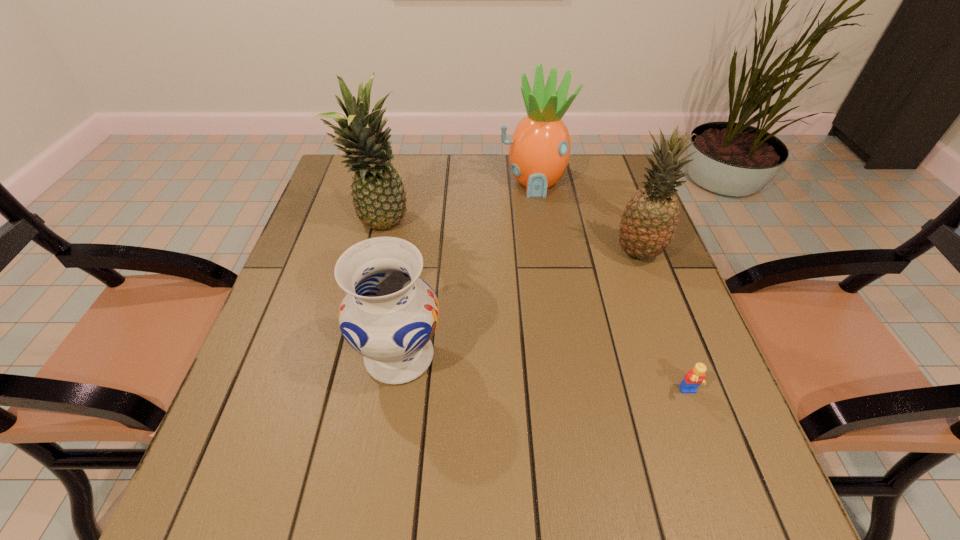
Find the location of a particular element. Image resolution: width=960 pixels, height=540 pixels. unoccupied area between the rightmost pineapple and the second shortest object is located at coordinates (518, 304).

The image size is (960, 540). What are the coordinates of `empty space between the farthest pineapple and the shortest object` in the screenshot? It's located at (612, 287).

Locate an element on the screen. The image size is (960, 540). object that is the third closest to the farthest object is located at coordinates (389, 314).

Locate an element on the screen. The width and height of the screenshot is (960, 540). the third closest object to the vase is located at coordinates (695, 377).

Locate which pineapple is the closest to the fourth tallest object. Please provide its 2D coordinates. Your answer should be formatted as a tuple, i.e. [(x, y)], where the tuple contains the x and y coordinates of a point satisfying the conditions above.

[(379, 198)]

Locate an element on the screen. pineapple that is the second closest to the rightmost pineapple is located at coordinates (379, 198).

Locate an element on the screen. Image resolution: width=960 pixels, height=540 pixels. blank area in the image that satisfies the following two spatial constraints: 1. at the entrance of the farthest pineapple; 2. on the left side of the rightmost pineapple is located at coordinates (543, 253).